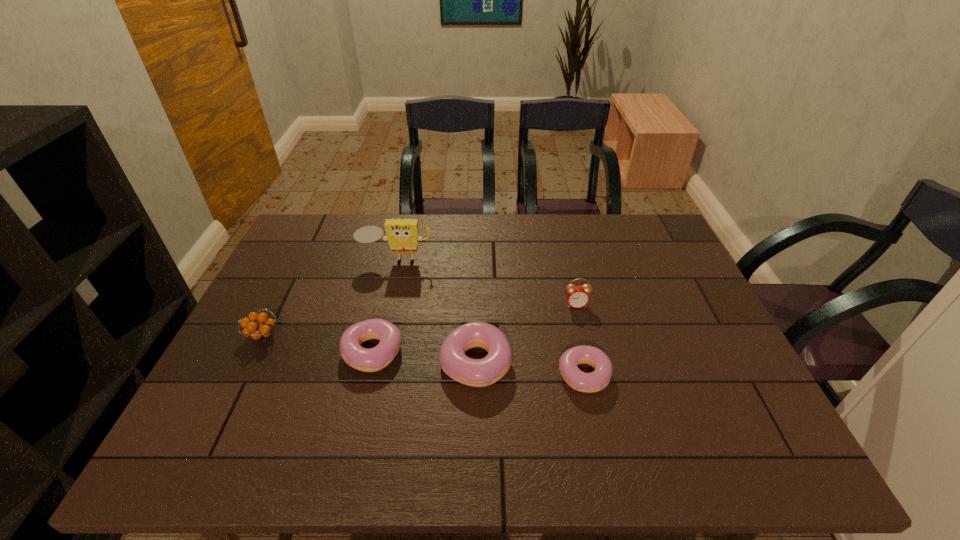
Where is `free space located 0.160m on the back of the third object from right to left`? Image resolution: width=960 pixels, height=540 pixels. free space located 0.160m on the back of the third object from right to left is located at coordinates (476, 293).

Locate an element on the screen. The width and height of the screenshot is (960, 540). vacant space located on the left of the shortest doughnut is located at coordinates (487, 374).

Find the location of a particular element. Image resolution: width=960 pixels, height=540 pixels. vacant point located on the front-facing side of the tallest object is located at coordinates (376, 348).

At what (x,y) coordinates should I click in order to perform the action: click on vacant area situated on the clock face of the alarm clock. Please return your answer as a coordinate pair (x, y). The width and height of the screenshot is (960, 540). Looking at the image, I should click on (587, 348).

The width and height of the screenshot is (960, 540). I want to click on vacant space situated on the right of the leftmost object, so click(366, 336).

You are a GUI agent. You are given a task and a screenshot of the screen. Output one action in this format:
    pyautogui.click(x=<x>, y=<y>)
    Task: Click on the object situated at the far edge
    
    Given the screenshot: What is the action you would take?
    pyautogui.click(x=402, y=235)

The width and height of the screenshot is (960, 540). In order to click on object that is at the left edge in this screenshot , I will do `click(260, 330)`.

Where is `vacant region at the far edge of the desktop`? vacant region at the far edge of the desktop is located at coordinates (539, 221).

In the image, there is a desktop. Where is `vacant space at the near edge`? The image size is (960, 540). vacant space at the near edge is located at coordinates (417, 399).

Locate an element on the screen. free space at the left edge of the desktop is located at coordinates (289, 346).